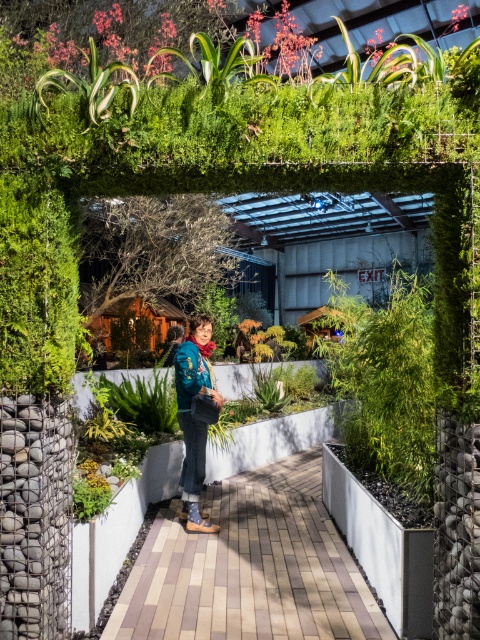
You are a visitor in the garden and want to take a photo of the textured blue jacket at center. However, the denim jacket at center is blocking your view. Which jacket should you move to get a clear shot?

You should move the denim jacket at center because the textured blue jacket at center is behind it, so moving the denim jacket would allow you to see the textured blue jacket clearly.

You are a gardener standing at the entrance of the greenhouse. You notice a brick paved walkway at center and a denim jacket at center. Which object is closer to the ground?

The brick paved walkway at center is below the denim jacket at center, so it is closer to the ground.